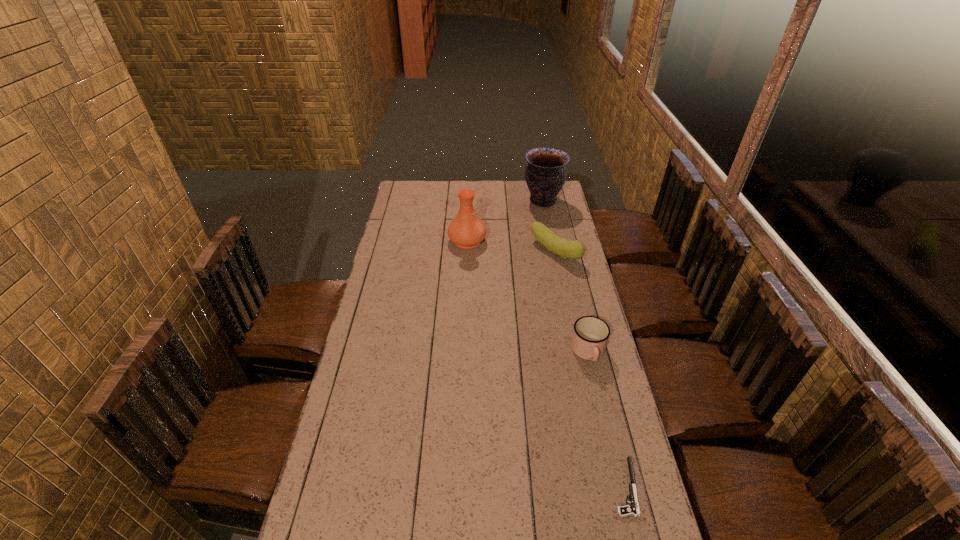
Where is `pottery`? pottery is located at coordinates (545, 174).

The image size is (960, 540). Find the location of `vase`. vase is located at coordinates click(x=466, y=230).

Find the location of `cucumber`. cucumber is located at coordinates (565, 248).

The width and height of the screenshot is (960, 540). In order to click on mug in this screenshot , I will do `click(590, 335)`.

Locate an element on the screen. pistol is located at coordinates (633, 509).

You are a GUI agent. You are given a task and a screenshot of the screen. Output one action in this format:
    pyautogui.click(x=<x>, y=<y>)
    Task: Click on the nearest object
    The height and width of the screenshot is (540, 960).
    Given the screenshot: What is the action you would take?
    pyautogui.click(x=633, y=509)

The height and width of the screenshot is (540, 960). I want to click on vacant space located 0.050m on the front handle of the pottery, so [513, 201].

This screenshot has height=540, width=960. In order to click on vacant space situated on the front handle of the pottery in this screenshot , I will do click(501, 201).

Identify the location of free point located 0.210m on the front handle of the pottery. (483, 201).

Where is `vacant space located on the left of the leftmost object`? The height and width of the screenshot is (540, 960). vacant space located on the left of the leftmost object is located at coordinates (404, 240).